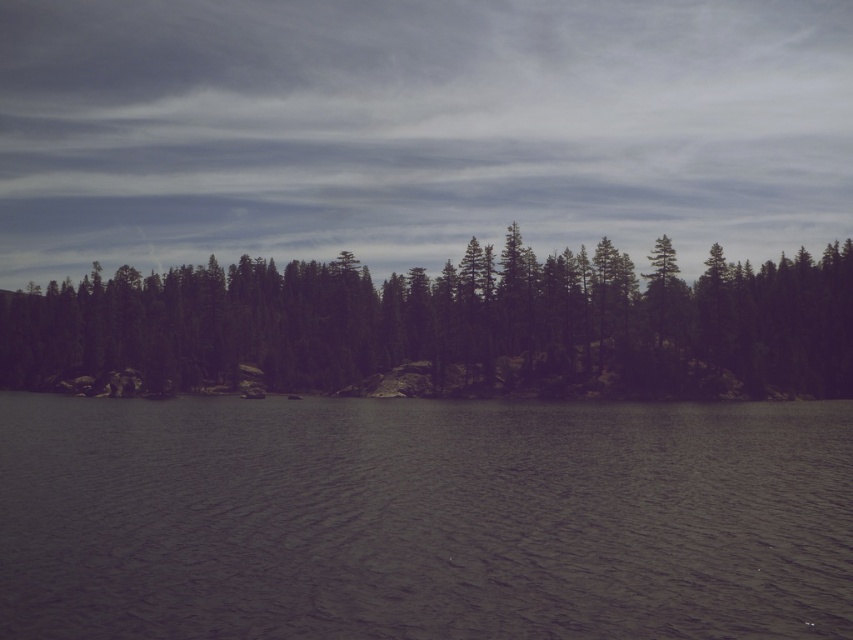
You are standing at the edge of the scene and want to take a photo of both the dark gray water at center and the green matte trees at center. Which object will appear larger in your photo?

The dark gray water at center will appear larger in the photo because it is closer to the viewer than the green matte trees at center.

You are an environmental scientist analyzing the landscape. Based on the scene, which object takes up more area in the image between the dark gray water at center and the green matte trees at center?

The green matte trees at center occupy more space than the dark gray water at center in the image.

You are standing at the point specified as point (x=422, y=518) in the image. Looking around, what do you see immediately around you?

You are standing at point (x=422, y=518) where dark gray water at center is located, so you are surrounded by dark gray water at center.